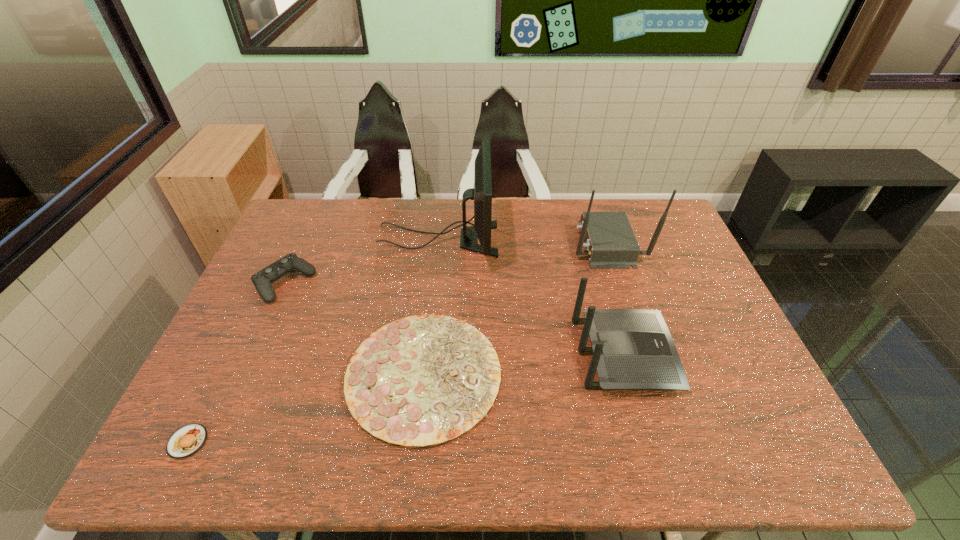
Where is `vacant space in between the fourth shortest object and the taller router`? Image resolution: width=960 pixels, height=540 pixels. vacant space in between the fourth shortest object and the taller router is located at coordinates [615, 299].

Identify the location of vacant area that lies between the pizza and the control. Image resolution: width=960 pixels, height=540 pixels. (354, 328).

This screenshot has width=960, height=540. What are the coordinates of `free space between the fourth tallest object and the patty` in the screenshot? It's located at (236, 362).

Where is `vacant area that lies between the control and the pizza`? vacant area that lies between the control and the pizza is located at coordinates (354, 328).

Locate an element on the screen. free space between the pizza and the taller router is located at coordinates pyautogui.click(x=515, y=309).

Find the location of `free area in between the taller router and the pizza`. free area in between the taller router and the pizza is located at coordinates (515, 309).

You are a GUI agent. You are given a task and a screenshot of the screen. Output one action in this format:
    pyautogui.click(x=<x>, y=<y>)
    Task: Click on the vacant area that lies between the pizza and the computer monitor
    The height and width of the screenshot is (540, 960).
    Given the screenshot: What is the action you would take?
    pyautogui.click(x=431, y=307)

I want to click on object that stands as the third closest to the shorter router, so click(482, 192).

I want to click on object that is the fourth closest to the pizza, so click(x=186, y=441).

Where is `free space that satisfies the following two spatial constraints: 1. on the front side of the third shortest object; 2. on the front-facing side of the shorter router`? This screenshot has height=540, width=960. free space that satisfies the following two spatial constraints: 1. on the front side of the third shortest object; 2. on the front-facing side of the shorter router is located at coordinates (253, 354).